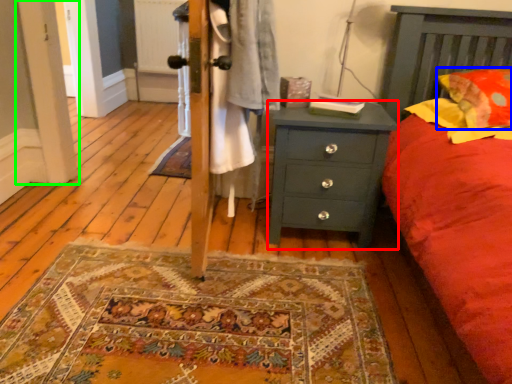
Question: Which is nearer to the chest of drawers (highlighted by a red box)? pillow (highlighted by a blue box) or screen door (highlighted by a green box).

Choices:
 (A) pillow
 (B) screen door

Answer: (A)